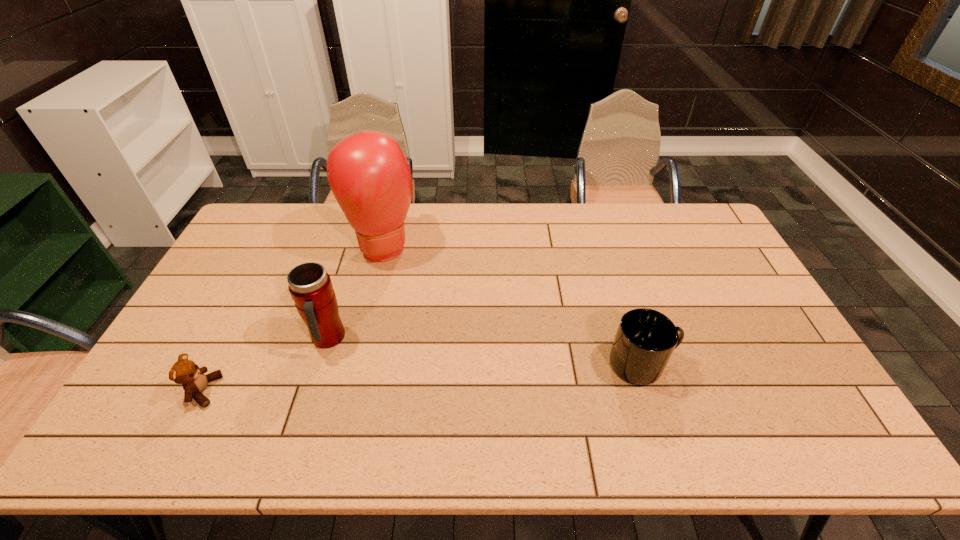
This screenshot has width=960, height=540. I want to click on free spot between the third tallest object and the shortest object, so click(x=423, y=377).

Where is `blank region between the boxing glove and the rightmost object`? The height and width of the screenshot is (540, 960). blank region between the boxing glove and the rightmost object is located at coordinates (514, 305).

You are a GUI agent. You are given a task and a screenshot of the screen. Output one action in this format:
    pyautogui.click(x=<x>, y=<y>)
    Task: Click on the vacant space in between the tallest object and the shortest object
    Image resolution: width=960 pixels, height=540 pixels.
    Given the screenshot: What is the action you would take?
    pyautogui.click(x=294, y=318)

Where is `vacant area that lies between the teddy bear and the tallest object`? The width and height of the screenshot is (960, 540). vacant area that lies between the teddy bear and the tallest object is located at coordinates tap(294, 318).

At what (x,y) coordinates should I click in order to perform the action: click on vacant area that lies between the thermos bottle and the leftmost object. Please return your answer as a coordinate pair (x, y). Looking at the image, I should click on (266, 366).

Select which object appears as the second closest to the boxing glove. Please provide its 2D coordinates. Your answer should be formatted as a tuple, i.e. [(x, y)], where the tuple contains the x and y coordinates of a point satisfying the conditions above.

[(194, 381)]

Identify which object is the nearest to the thermos bottle. Please provide its 2D coordinates. Your answer should be formatted as a tuple, i.e. [(x, y)], where the tuple contains the x and y coordinates of a point satisfying the conditions above.

[(194, 381)]

Locate an element on the screen. This screenshot has height=540, width=960. vacant space that satisfies the following two spatial constraints: 1. on the front side of the rightmost object; 2. with the handle on the side of the second tallest object is located at coordinates (320, 364).

What are the coordinates of `vacant space that satisfies the following two spatial constraints: 1. on the front side of the thermos bottle; 2. with the handle on the side of the third tallest object` in the screenshot? It's located at (320, 364).